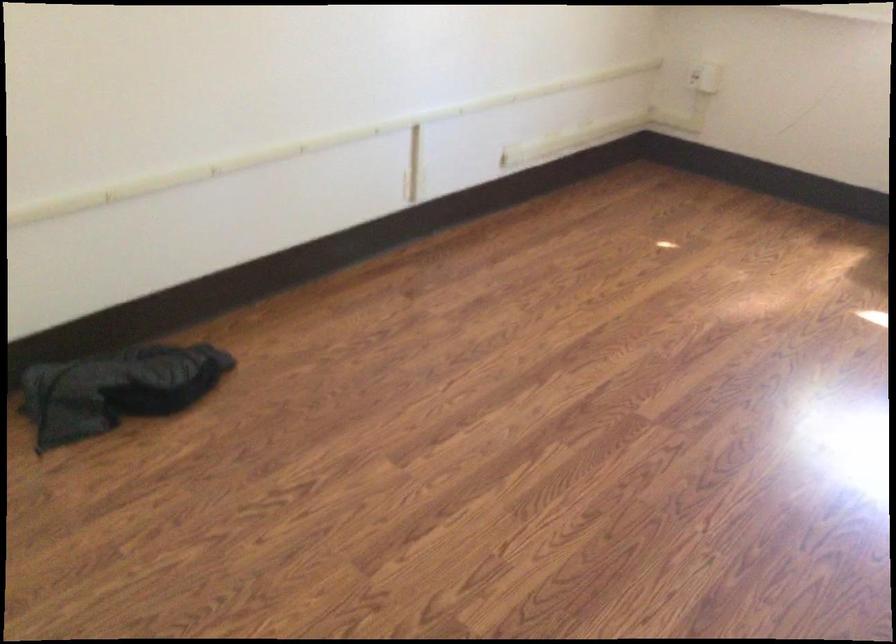
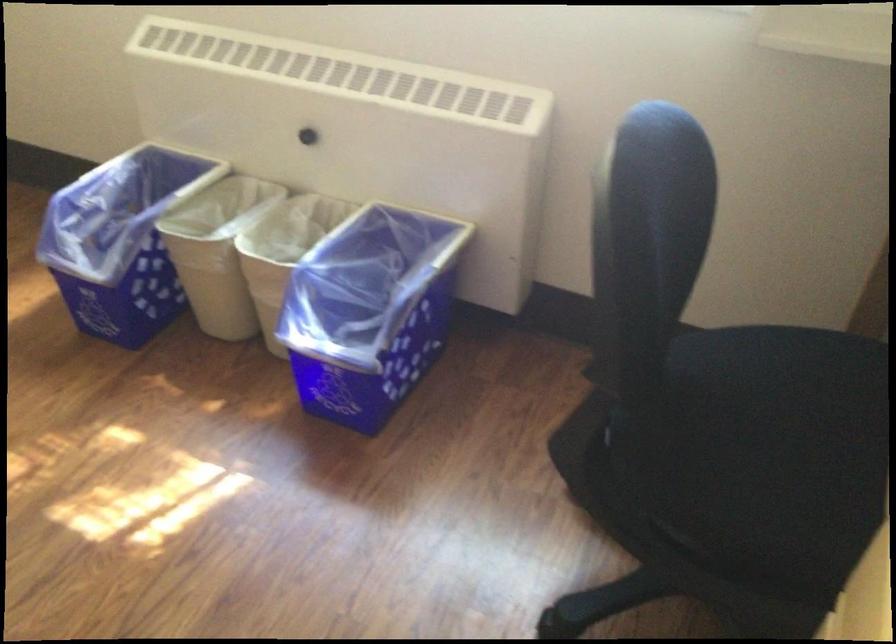
In a continuous first-person perspective shot, in which direction is the camera moving?

The movement direction of the cameraman is right, forward.